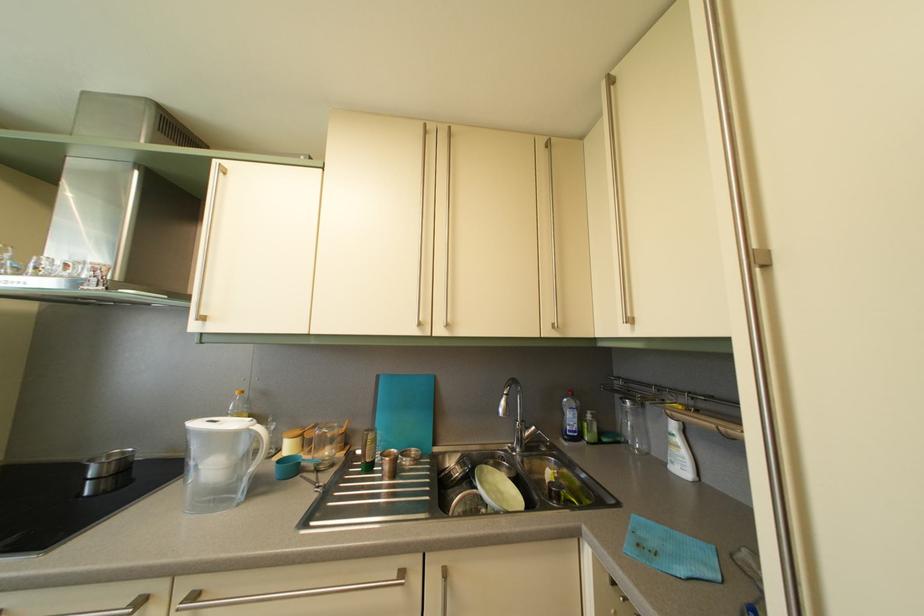
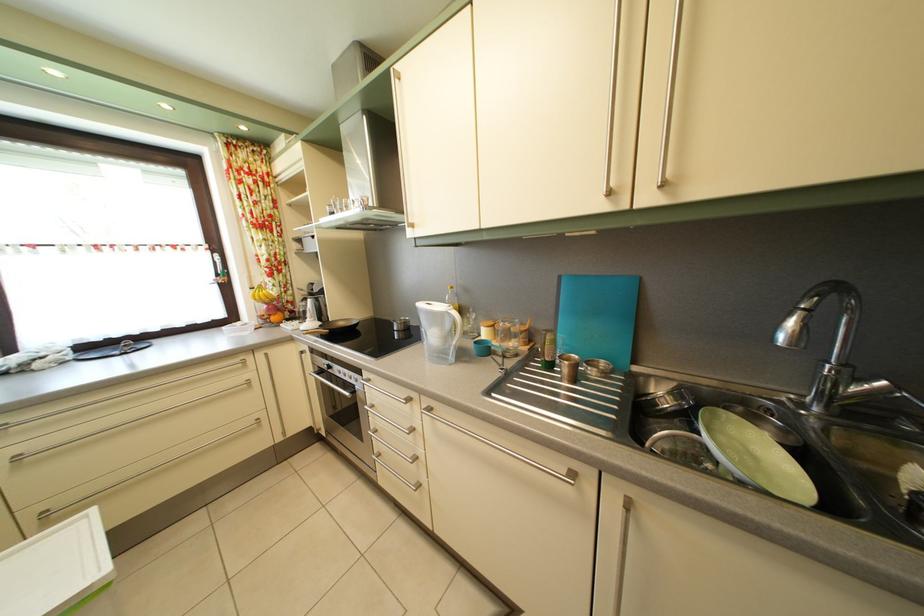
Locate, in the second image, the point that corresponds to the point at 286,469 in the first image.

(483, 350)